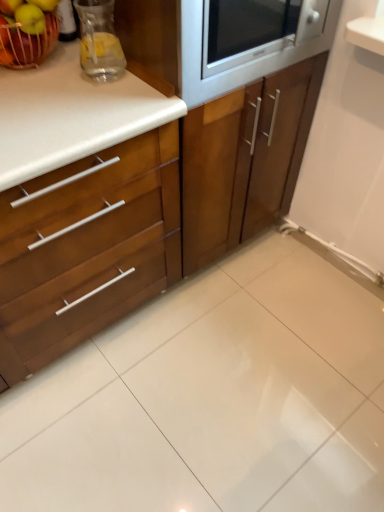
Question: Is wooden cabinet at left, which appears as the 1th cabinetry when viewed from the left, further to the viewer compared to green matte apple at upper left, placed as the second apple when sorted from left to right?

Choices:
 (A) no
 (B) yes

Answer: (A)

Question: Does wooden cabinet at left, which ranks as the 2th cabinetry in right-to-left order, lie in front of green matte apple at upper left, which appears as the 1th apple when viewed from the right?

Choices:
 (A) no
 (B) yes

Answer: (B)

Question: Is wooden cabinet at left, which ranks as the 2th cabinetry in right-to-left order, facing away from green matte apple at upper left, which appears as the 1th apple when viewed from the right?

Choices:
 (A) no
 (B) yes

Answer: (A)

Question: From the image's perspective, is wooden cabinet at left, which appears as the 1th cabinetry when viewed from the left, above green matte apple at upper left, placed as the second apple when sorted from left to right?

Choices:
 (A) yes
 (B) no

Answer: (B)

Question: Can you confirm if wooden cabinet at left, which ranks as the 2th cabinetry in right-to-left order, is thinner than green matte apple at upper left, placed as the second apple when sorted from left to right?

Choices:
 (A) no
 (B) yes

Answer: (A)

Question: In the image, is wooden cabinet at center, positioned as the 1th cabinetry in right-to-left order, on the left side or the right side of green matte apple at upper left, placed as the second apple when sorted from left to right?

Choices:
 (A) right
 (B) left

Answer: (A)

Question: In terms of size, does wooden cabinet at center, which is counted as the 2th cabinetry, starting from the left, appear bigger or smaller than green matte apple at upper left, placed as the second apple when sorted from left to right?

Choices:
 (A) big
 (B) small

Answer: (A)

Question: In the image, is wooden cabinet at center, which is counted as the 2th cabinetry, starting from the left, positioned in front of or behind green matte apple at upper left, which appears as the 1th apple when viewed from the right?

Choices:
 (A) front
 (B) behind

Answer: (A)

Question: Is point (228, 168) positioned closer to the camera than point (16, 16)?

Choices:
 (A) closer
 (B) farther

Answer: (B)

Question: Based on their positions, is satin silver microwave at upper center located to the left or right of shiny red apple at upper left, the 2th apple in the right-to-left sequence?

Choices:
 (A) right
 (B) left

Answer: (A)

Question: Is point (244, 65) closer or farther from the camera than point (56, 1)?

Choices:
 (A) farther
 (B) closer

Answer: (A)

Question: In terms of width, does satin silver microwave at upper center look wider or thinner when compared to shiny red apple at upper left, which appears as the first apple when viewed from the left?

Choices:
 (A) wide
 (B) thin

Answer: (A)

Question: From a real-world perspective, relative to shiny red apple at upper left, the 2th apple in the right-to-left sequence, is satin silver microwave at upper center vertically above or below?

Choices:
 (A) above
 (B) below

Answer: (A)

Question: Is green matte apple at upper left, which appears as the 1th apple when viewed from the right, wider or thinner than wooden cabinet at center, which is counted as the 2th cabinetry, starting from the left?

Choices:
 (A) thin
 (B) wide

Answer: (A)

Question: In terms of size, does green matte apple at upper left, which appears as the 1th apple when viewed from the right, appear bigger or smaller than wooden cabinet at center, which is counted as the 2th cabinetry, starting from the left?

Choices:
 (A) big
 (B) small

Answer: (B)